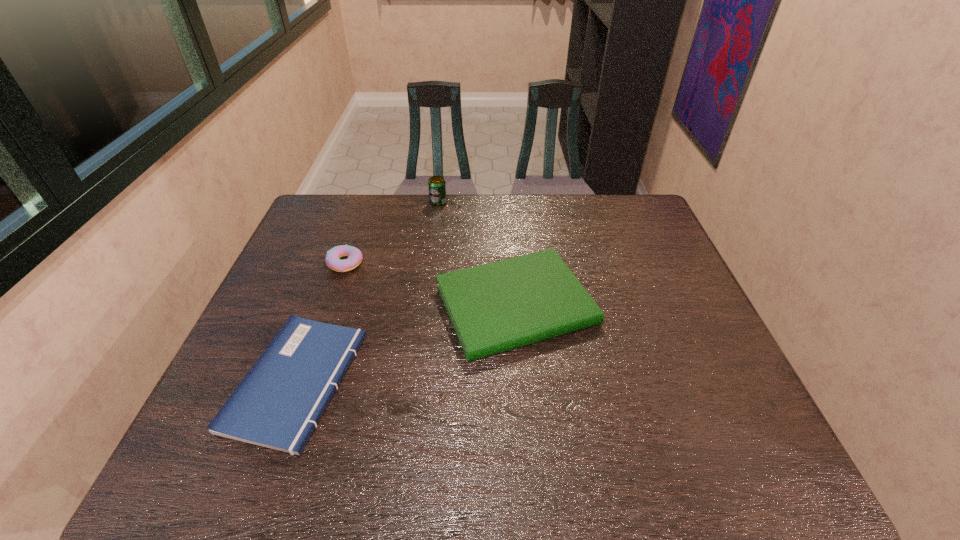
Image resolution: width=960 pixels, height=540 pixels. I want to click on free space at the near left corner of the desktop, so click(x=267, y=449).

Locate an element on the screen. vacant space at the near right corner of the desktop is located at coordinates (785, 473).

Locate an element on the screen. vacant space that is in between the farthest object and the doughnut is located at coordinates (392, 233).

Where is `vacant point located between the doughnut and the beer can`? This screenshot has height=540, width=960. vacant point located between the doughnut and the beer can is located at coordinates (392, 233).

What are the coordinates of `blank region between the left paperback book and the doughnut` in the screenshot? It's located at (322, 322).

The width and height of the screenshot is (960, 540). I want to click on free space between the tallest object and the shortest object, so click(x=368, y=292).

Locate an element on the screen. This screenshot has height=540, width=960. free space between the tallest object and the right paperback book is located at coordinates (477, 254).

Identify the location of empty space that is in between the doughnut and the shorter paperback book. (322, 322).

Image resolution: width=960 pixels, height=540 pixels. I want to click on free spot between the right paperback book and the farthest object, so click(x=477, y=254).

The height and width of the screenshot is (540, 960). Find the location of `vacant space in between the right paperback book and the doughnut`. vacant space in between the right paperback book and the doughnut is located at coordinates (431, 284).